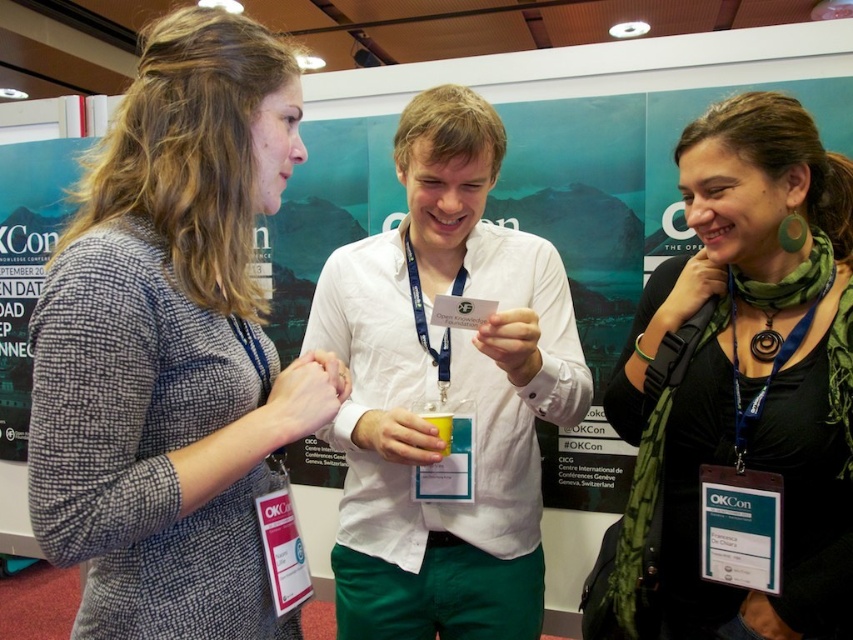
You are a conference attendee who wants to place the yellow plastic cup at center on the table without it touching the white cotton shirt at center. Is the cup smaller than the shirt?

The white cotton shirt at center is larger in size than the yellow plastic cup at center, so yes, the cup is smaller and can be placed without touching the shirt.